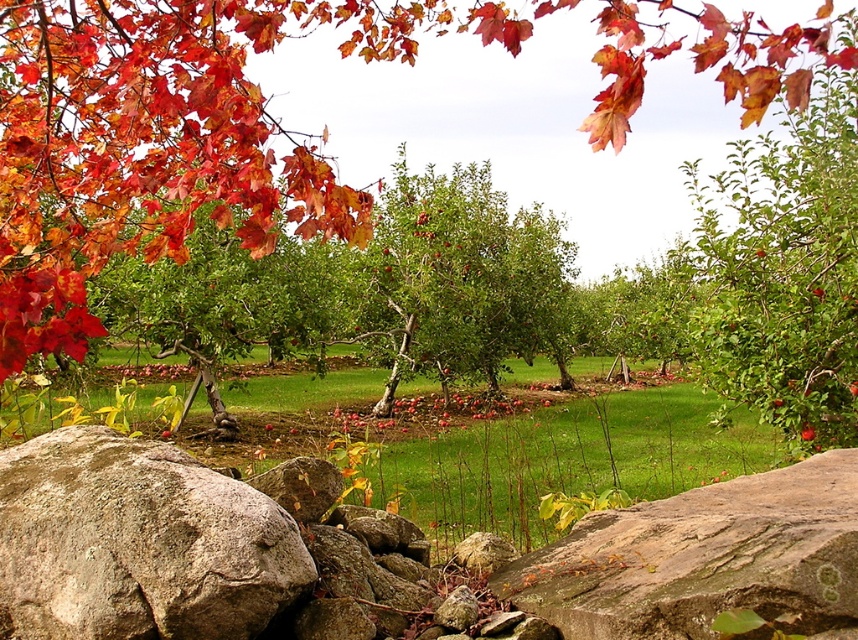
Question: Can you confirm if gray rough boulder at lower left is positioned below brown rough rock at lower center?

Choices:
 (A) no
 (B) yes

Answer: (A)

Question: Can you confirm if gray rough boulder at lower left is positioned to the right of brown rough rock at lower center?

Choices:
 (A) yes
 (B) no

Answer: (B)

Question: Does gray rough boulder at lower left appear under brown rough rock at lower center?

Choices:
 (A) no
 (B) yes

Answer: (A)

Question: Which point is farther to the camera?

Choices:
 (A) (792, 468)
 (B) (198, 481)

Answer: (A)